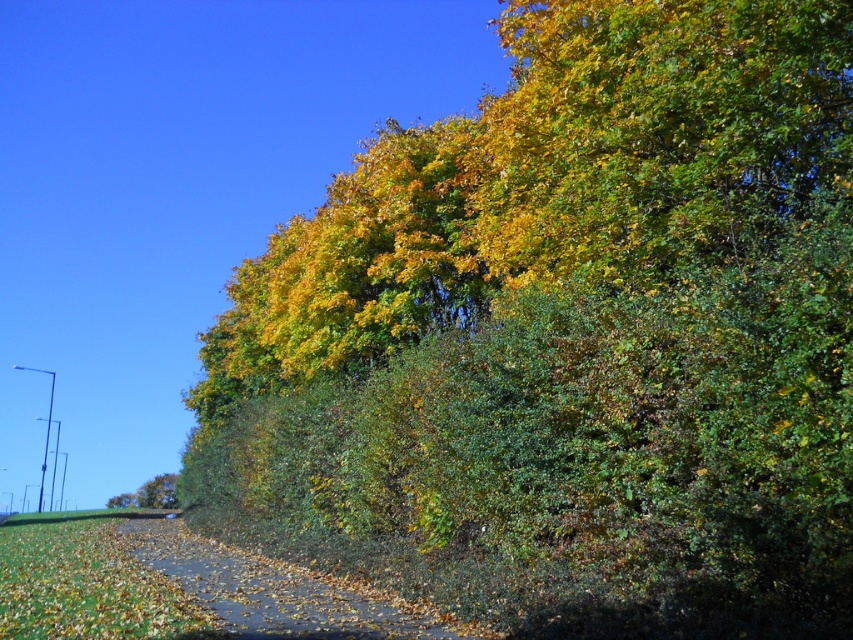
Question: Which point appears closest to the camera in this image?

Choices:
 (A) (223, 580)
 (B) (149, 490)

Answer: (A)

Question: Observing the image, what is the correct spatial positioning of brown leafy path at lower center in reference to green leafy tree at lower left?

Choices:
 (A) below
 (B) above

Answer: (B)

Question: Which of the following is the farthest from the observer?

Choices:
 (A) green leafy tree at lower left
 (B) brown leafy path at lower center

Answer: (A)

Question: From the image, what is the correct spatial relationship of brown leafy path at lower center in relation to green leafy tree at lower left?

Choices:
 (A) right
 (B) left

Answer: (A)

Question: Is brown leafy path at lower center bigger than green leafy tree at lower left?

Choices:
 (A) yes
 (B) no

Answer: (A)